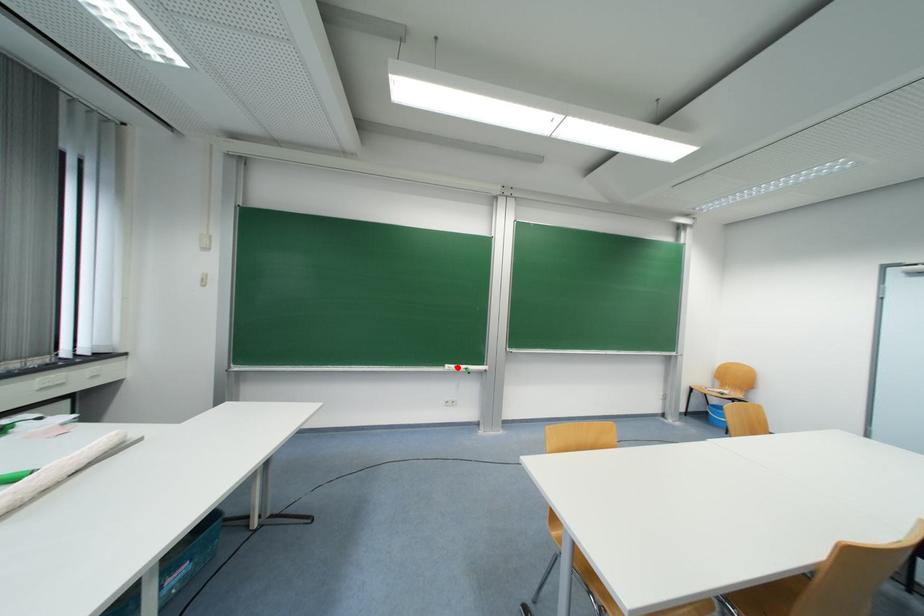
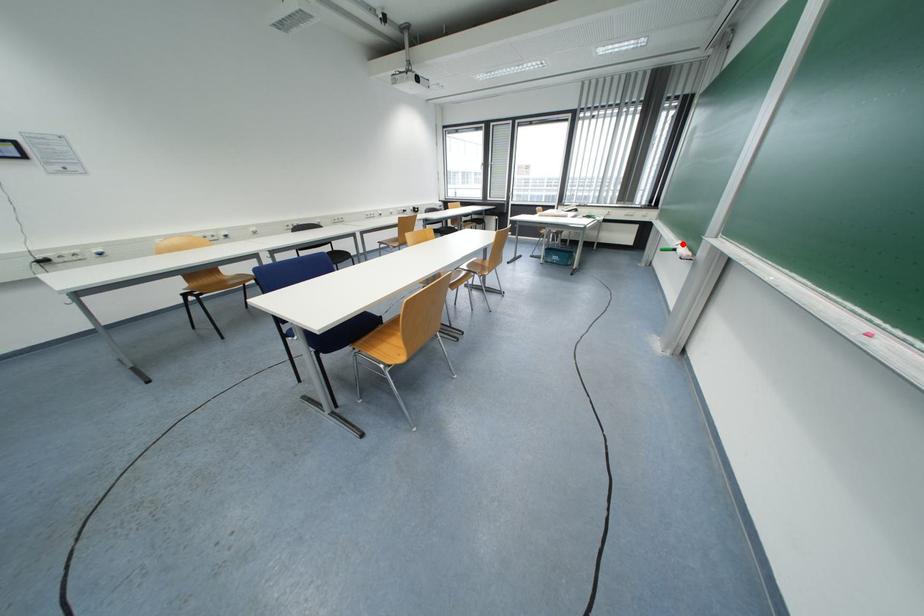
I am providing you with two images of the same scene from different viewpoints. A red point is marked on the first image and another point is marked on the second image. Is the marked point in image1 the same physical position as the marked point in image2?

Yes